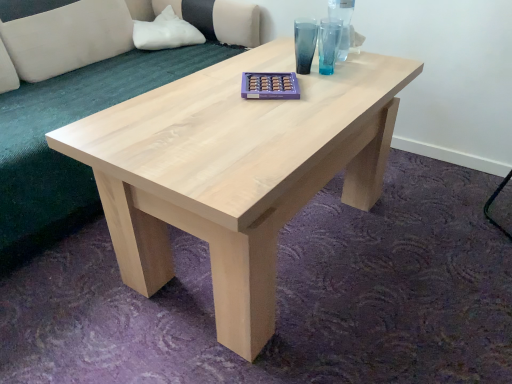
Question: Should I look upward or downward to see natural wood coffee table at center?

Choices:
 (A) down
 (B) up

Answer: (A)

Question: Considering the relative sizes of white fabric pillow at upper left and light beige fabric couch at upper left in the image provided, is white fabric pillow at upper left smaller than light beige fabric couch at upper left?

Choices:
 (A) yes
 (B) no

Answer: (A)

Question: Is light beige fabric couch at upper left at the back of white fabric pillow at upper left?

Choices:
 (A) no
 (B) yes

Answer: (B)

Question: Does white fabric pillow at upper left have a lesser width compared to light beige fabric couch at upper left?

Choices:
 (A) yes
 (B) no

Answer: (A)

Question: Considering the relative sizes of white fabric pillow at upper left and light beige fabric couch at upper left in the image provided, is white fabric pillow at upper left bigger than light beige fabric couch at upper left?

Choices:
 (A) no
 (B) yes

Answer: (A)

Question: From the image's perspective, is white fabric pillow at upper left under light beige fabric couch at upper left?

Choices:
 (A) yes
 (B) no

Answer: (B)

Question: Is white fabric pillow at upper left to the left of light beige fabric couch at upper left from the viewer's perspective?

Choices:
 (A) yes
 (B) no

Answer: (B)

Question: Can we say light beige fabric couch at upper left lies outside white fabric pillow at upper left?

Choices:
 (A) yes
 (B) no

Answer: (A)

Question: Is the position of light beige fabric couch at upper left more distant than that of white fabric pillow at upper left?

Choices:
 (A) yes
 (B) no

Answer: (B)

Question: Is light beige fabric couch at upper left far from white fabric pillow at upper left?

Choices:
 (A) no
 (B) yes

Answer: (A)

Question: Could you tell me if light beige fabric couch at upper left is turned towards white fabric pillow at upper left?

Choices:
 (A) yes
 (B) no

Answer: (B)

Question: Can you confirm if light beige fabric couch at upper left is shorter than white fabric pillow at upper left?

Choices:
 (A) yes
 (B) no

Answer: (B)

Question: Is light beige fabric couch at upper left to the left of white fabric pillow at upper left from the viewer's perspective?

Choices:
 (A) no
 (B) yes

Answer: (B)

Question: Is natural wood coffee table at center positioned in front of light beige fabric couch at upper left?

Choices:
 (A) yes
 (B) no

Answer: (A)